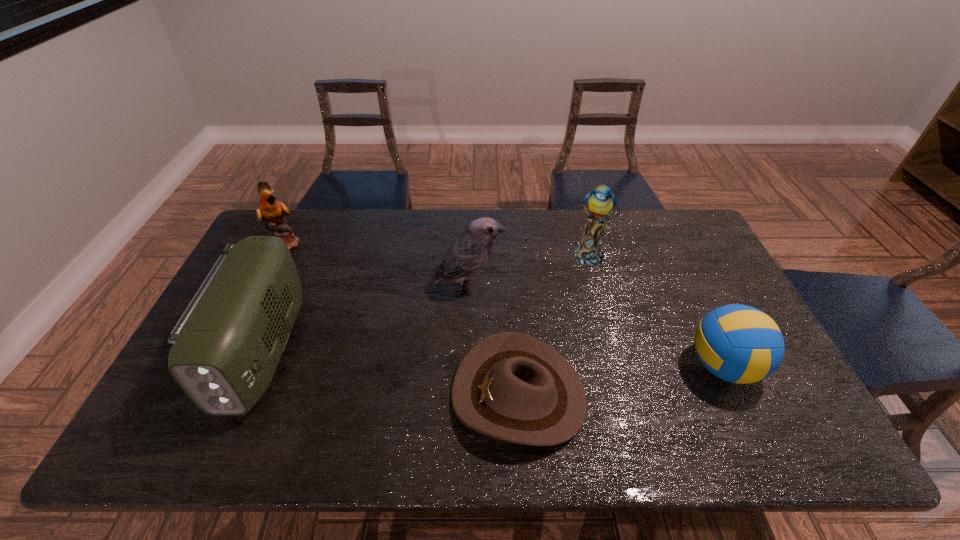
I want to click on the rightmost parrot, so click(x=599, y=203).

This screenshot has width=960, height=540. What are the coordinates of `the leftmost parrot` in the screenshot? It's located at (271, 211).

Identify the location of the nearest parrot. This screenshot has width=960, height=540. (469, 253).

Locate an element on the screen. radio_receiver is located at coordinates (226, 347).

At what (x,y) coordinates should I click in order to perform the action: click on the second shortest object. Please return your answer as a coordinate pair (x, y). Image resolution: width=960 pixels, height=540 pixels. Looking at the image, I should click on (740, 344).

Image resolution: width=960 pixels, height=540 pixels. In order to click on the rightmost object in this screenshot , I will do `click(740, 344)`.

Identify the location of cowboy hat. (511, 386).

This screenshot has height=540, width=960. I want to click on free space located 0.050m on the face of the second object from right to left, so (596, 281).

You are a GUI agent. You are given a task and a screenshot of the screen. Output one action in this format:
    pyautogui.click(x=<x>, y=<y>)
    Task: Click on the free spot located 0.160m on the front-facing side of the leftmost parrot
    The width and height of the screenshot is (960, 540).
    Given the screenshot: What is the action you would take?
    pyautogui.click(x=348, y=244)

The width and height of the screenshot is (960, 540). I want to click on vacant space located on the front-facing side of the second parrot from left to right, so click(x=576, y=287).